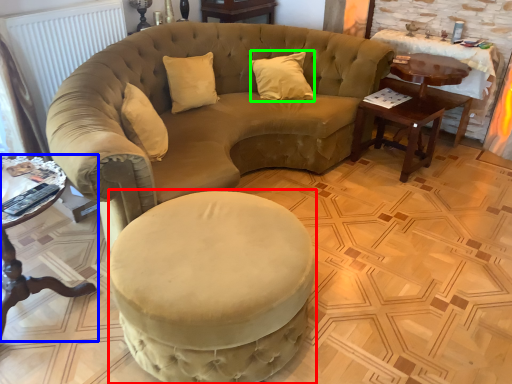
Question: Which is farther away from swivel chair (highlighted by a red box)? table (highlighted by a blue box) or pillow (highlighted by a green box)?

Choices:
 (A) table
 (B) pillow

Answer: (B)